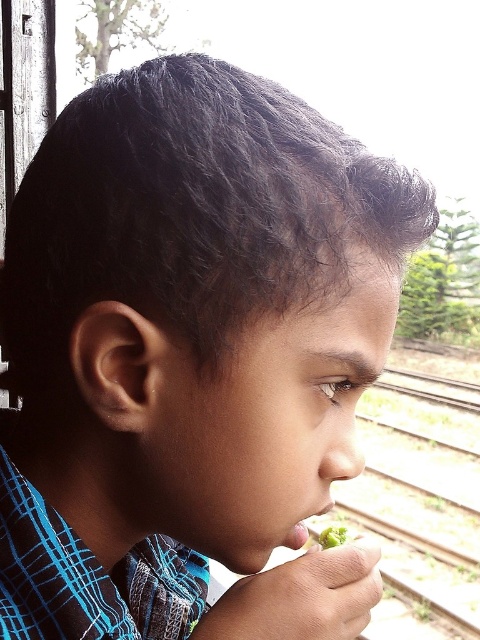
Question: Which point is farther from the camera taking this photo?

Choices:
 (A) (414, 404)
 (B) (322, 547)

Answer: (A)

Question: Among these objects, which one is nearest to the camera?

Choices:
 (A) metal train track at right
 (B) green matte food at mouth

Answer: (B)

Question: Does metal train track at right appear under green matte food at mouth?

Choices:
 (A) yes
 (B) no

Answer: (A)

Question: Is metal train track at right positioned before green matte food at mouth?

Choices:
 (A) no
 (B) yes

Answer: (A)

Question: Where is metal train track at right located in relation to green matte food at mouth in the image?

Choices:
 (A) right
 (B) left

Answer: (A)